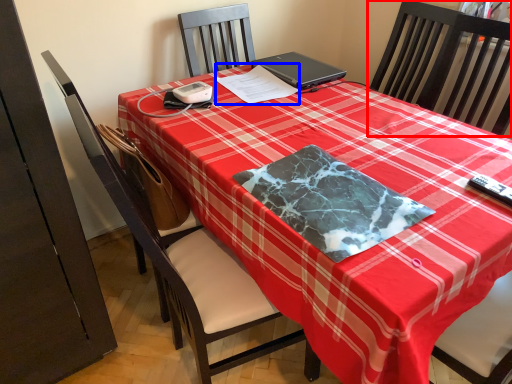
Question: Which object is closer to the camera taking this photo, chair (highlighted by a red box) or notepad (highlighted by a blue box)?

Choices:
 (A) chair
 (B) notepad

Answer: (A)